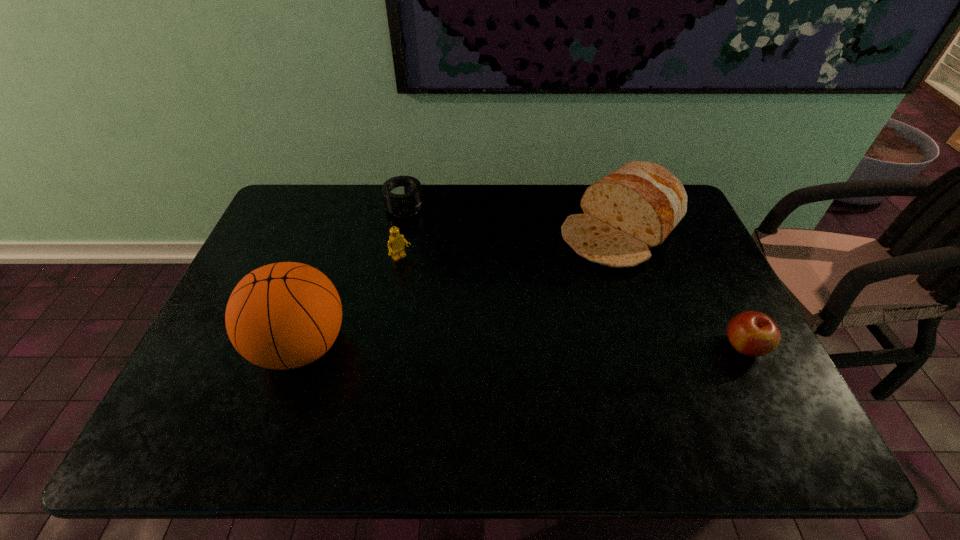
You are a GUI agent. You are given a task and a screenshot of the screen. Output one action in this format:
    pyautogui.click(x=<x>, y=<y>)
    Task: Click on the closest object to the Lego
    The image size is (960, 540).
    Given the screenshot: What is the action you would take?
    pyautogui.click(x=402, y=195)

Locate an element on the screen. The width and height of the screenshot is (960, 540). vacant position in the image that satisfies the following two spatial constraints: 1. on the front side of the Lego; 2. on the right side of the telephoto lens is located at coordinates (395, 259).

Image resolution: width=960 pixels, height=540 pixels. I want to click on free space that satisfies the following two spatial constraints: 1. on the front side of the apple; 2. on the stem of the bread, so click(x=660, y=346).

Identify the location of vacant point that satisfies the following two spatial constraints: 1. on the back side of the tallest object; 2. on the right side of the shortest object. (348, 208).